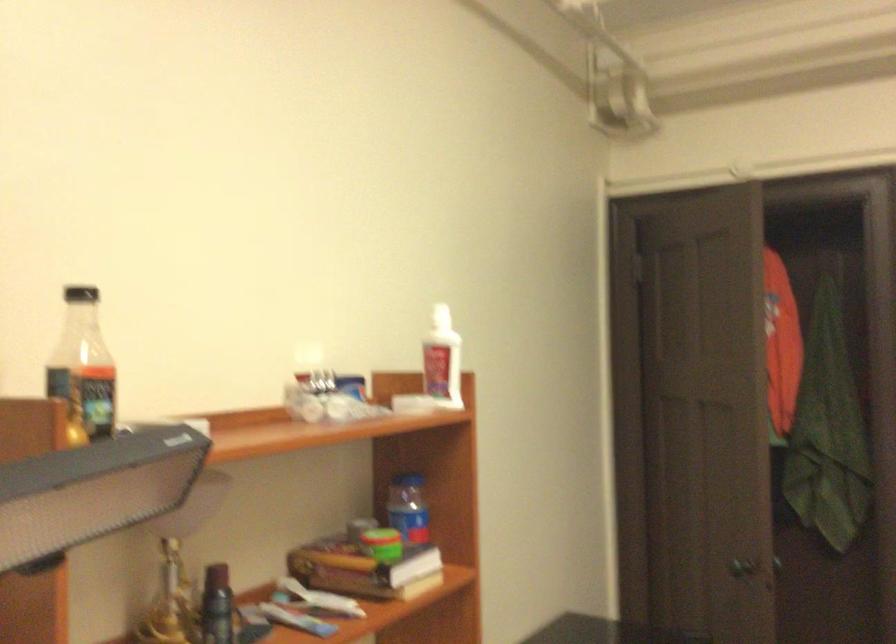
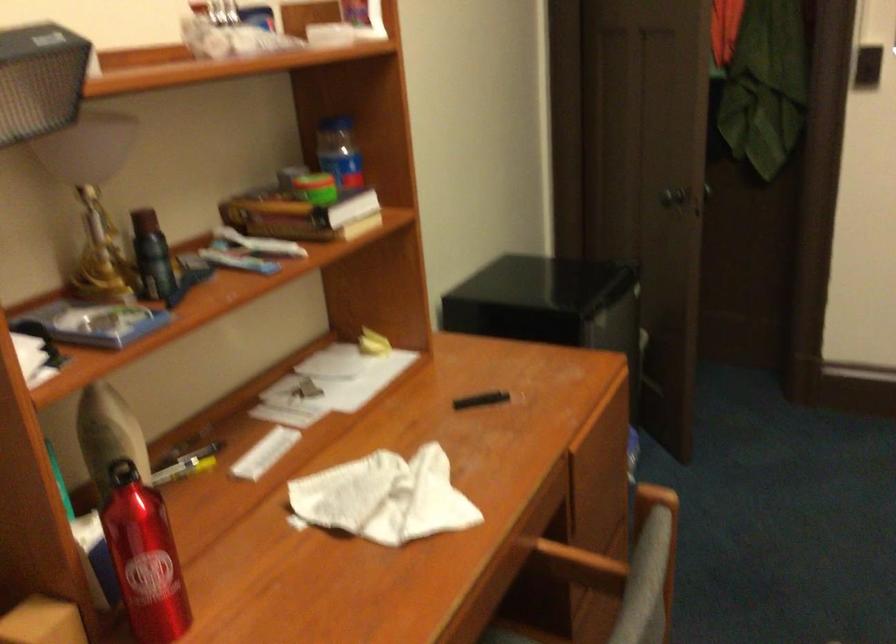
The point at (734, 560) is marked in the first image. Where is the corresponding point in the second image?

(666, 194)